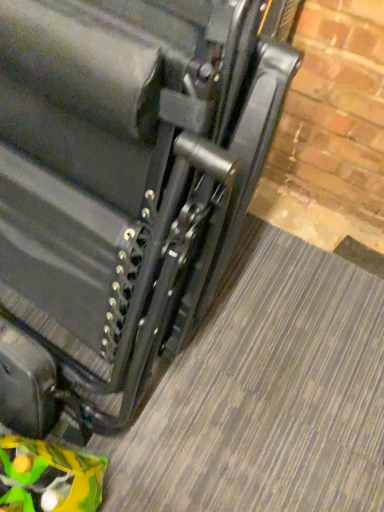
Question: From the image's perspective, relative to green plastic toy at lower left, is matte black suitcase at center above or below?

Choices:
 (A) below
 (B) above

Answer: (B)

Question: Is matte black suitcase at center wider or thinner than green plastic toy at lower left?

Choices:
 (A) wide
 (B) thin

Answer: (A)

Question: In the image, is matte black suitcase at center on the left side or the right side of green plastic toy at lower left?

Choices:
 (A) right
 (B) left

Answer: (A)

Question: Looking at the image, does green plastic toy at lower left seem bigger or smaller compared to matte black suitcase at center?

Choices:
 (A) small
 (B) big

Answer: (A)

Question: Is point (69, 486) closer or farther from the camera than point (102, 6)?

Choices:
 (A) farther
 (B) closer

Answer: (A)

Question: Is green plastic toy at lower left taller or shorter than matte black suitcase at center?

Choices:
 (A) tall
 (B) short

Answer: (B)

Question: Is green plastic toy at lower left wider or thinner than matte black suitcase at center?

Choices:
 (A) thin
 (B) wide

Answer: (A)